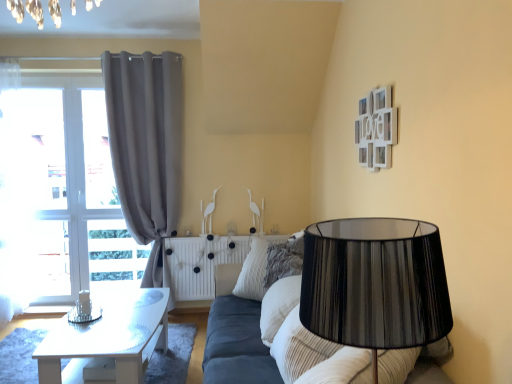
I want to click on black pleated lampshade at center, so click(375, 284).

Describe the element at coordinates (146, 147) in the screenshot. I see `gray fabric curtain at left` at that location.

Measure the distance between white wooden picture frame at upper right and camera.

A distance of 7.05 feet exists between white wooden picture frame at upper right and camera.

The height and width of the screenshot is (384, 512). Find the location of `black pleated lampshade at center`. black pleated lampshade at center is located at coordinates (375, 284).

From a real-world perspective, relative to black pleated lampshade at center, is white textured radiator at center vertically above or below?

From a real-world perspective, white textured radiator at center is physically below black pleated lampshade at center.

From the image's perspective, is white textured radiator at center beneath black pleated lampshade at center?

Yes, from the image's perspective, white textured radiator at center is below black pleated lampshade at center.

From the picture: Which object is more forward, white textured radiator at center or black pleated lampshade at center?

black pleated lampshade at center is more forward.

Can you confirm if white glossy table at left is positioned to the right of black pleated lampshade at center?

In fact, white glossy table at left is to the left of black pleated lampshade at center.

From the image's perspective, is white glossy table at left over black pleated lampshade at center?

No, from the image's perspective, white glossy table at left is not above black pleated lampshade at center.

Considering the relative sizes of white glossy table at left and black pleated lampshade at center in the image provided, is white glossy table at left shorter than black pleated lampshade at center?

Yes, white glossy table at left is shorter than black pleated lampshade at center.

Considering the sizes of gray fabric curtain at left and white wooden picture frame at upper right in the image, is gray fabric curtain at left wider or thinner than white wooden picture frame at upper right?

Considering their sizes, gray fabric curtain at left looks broader than white wooden picture frame at upper right.

In the scene shown: Is gray fabric curtain at left not near white wooden picture frame at upper right?

Yes, gray fabric curtain at left and white wooden picture frame at upper right are quite far apart.

Considering the positions of objects gray fabric curtain at left and white wooden picture frame at upper right in the image provided, who is more to the left, gray fabric curtain at left or white wooden picture frame at upper right?

gray fabric curtain at left is more to the left.

Is gray fabric curtain at left facing away from white wooden picture frame at upper right?

No, white wooden picture frame at upper right is not at the back of gray fabric curtain at left.

What are the coordinates of `lamp on the right of white glossy table at left` in the screenshot? It's located at (375, 284).

How different are the orientations of black pleated lampshade at center and white glossy table at left in degrees?

black pleated lampshade at center and white glossy table at left are facing 50.4 degrees away from each other.

Can you confirm if black pleated lampshade at center is bigger than white glossy table at left?

Incorrect, black pleated lampshade at center is not larger than white glossy table at left.

From a real-world perspective, is black pleated lampshade at center under white glossy table at left?

No, from a real-world perspective, black pleated lampshade at center is not under white glossy table at left.

Is white textured radiator at center bigger than white wooden picture frame at upper right?

Indeed, white textured radiator at center has a larger size compared to white wooden picture frame at upper right.

Is white textured radiator at center shorter than white wooden picture frame at upper right?

Incorrect, the height of white textured radiator at center does not fall short of that of white wooden picture frame at upper right.

From the image's perspective, would you say white textured radiator at center is positioned over white wooden picture frame at upper right?

Actually, white textured radiator at center appears below white wooden picture frame at upper right in the image.

From the image's perspective, which is below, white wooden picture frame at upper right or gray fabric curtain at left?

gray fabric curtain at left, from the image's perspective.

Which of these two, white wooden picture frame at upper right or gray fabric curtain at left, stands taller?

With more height is gray fabric curtain at left.

Is gray fabric curtain at left at the back of white wooden picture frame at upper right?

No, white wooden picture frame at upper right is not facing away from gray fabric curtain at left.

Between white wooden picture frame at upper right and gray fabric curtain at left, which one appears on the right side from the viewer's perspective?

white wooden picture frame at upper right.

Is black pleated lampshade at center inside the boundaries of striped fabric pillow at center, or outside?

black pleated lampshade at center is not inside striped fabric pillow at center, it's outside.

How many degrees apart are the facing directions of black pleated lampshade at center and striped fabric pillow at center?

black pleated lampshade at center and striped fabric pillow at center are facing 103 degrees away from each other.

From the image's perspective, is black pleated lampshade at center positioned above or below striped fabric pillow at center?

black pleated lampshade at center is below striped fabric pillow at center.

From a real-world perspective, is black pleated lampshade at center over striped fabric pillow at center?

Actually, black pleated lampshade at center is physically below striped fabric pillow at center in the real world.

This screenshot has width=512, height=384. In order to click on lamp that appears above the white textured radiator at center (from the image's perspective) in this screenshot , I will do `click(375, 284)`.

Locate an element on the screen. This screenshot has width=512, height=384. table below the black pleated lampshade at center (from a real-world perspective) is located at coordinates (111, 336).

From the picture: Estimate the real-world distances between objects in this image. Which object is further from white textured radiator at center, black pleated lampshade at center or gray fabric curtain at left?

The object further to white textured radiator at center is black pleated lampshade at center.

Estimate the real-world distances between objects in this image. Which object is further from black pleated lampshade at center, striped fabric pillow at center or white glossy table at left?

striped fabric pillow at center is positioned further to the anchor black pleated lampshade at center.

Looking at the image, which one is located further to white textured radiator at center, striped fabric pillow at center or gray fabric curtain at left?

The object further to white textured radiator at center is gray fabric curtain at left.

Estimate the real-world distances between objects in this image. Which object is further from white textured radiator at center, white wooden picture frame at upper right or black pleated lampshade at center?

Among the two, black pleated lampshade at center is located further to white textured radiator at center.

Based on their spatial positions, is white glossy table at left or white wooden picture frame at upper right closer to black pleated lampshade at center?

white wooden picture frame at upper right lies closer to black pleated lampshade at center than the other object.

Based on their spatial positions, is gray fabric curtain at left or striped fabric pillow at center further from black pleated lampshade at center?

gray fabric curtain at left is positioned further to the anchor black pleated lampshade at center.

From the image, which object appears to be farther from striped fabric pillow at center, gray fabric curtain at left or white wooden picture frame at upper right?

Based on the image, gray fabric curtain at left appears to be further to striped fabric pillow at center.

Looking at the image, which one is located closer to white wooden picture frame at upper right, gray fabric curtain at left or white textured radiator at center?

The object closer to white wooden picture frame at upper right is white textured radiator at center.

Locate an element on the screen. Image resolution: width=512 pixels, height=384 pixels. pillow situated between white glossy table at left and white wooden picture frame at upper right from left to right is located at coordinates (268, 266).

This screenshot has height=384, width=512. Find the location of `picture frame between black pleated lampshade at center and white textured radiator at center in the front-back direction`. picture frame between black pleated lampshade at center and white textured radiator at center in the front-back direction is located at coordinates (376, 129).

Where is `table between gray fabric curtain at left and white wooden picture frame at upper right in the horizontal direction`? The image size is (512, 384). table between gray fabric curtain at left and white wooden picture frame at upper right in the horizontal direction is located at coordinates (111, 336).

This screenshot has height=384, width=512. I want to click on pillow between white wooden picture frame at upper right and white textured radiator at center from front to back, so click(x=268, y=266).